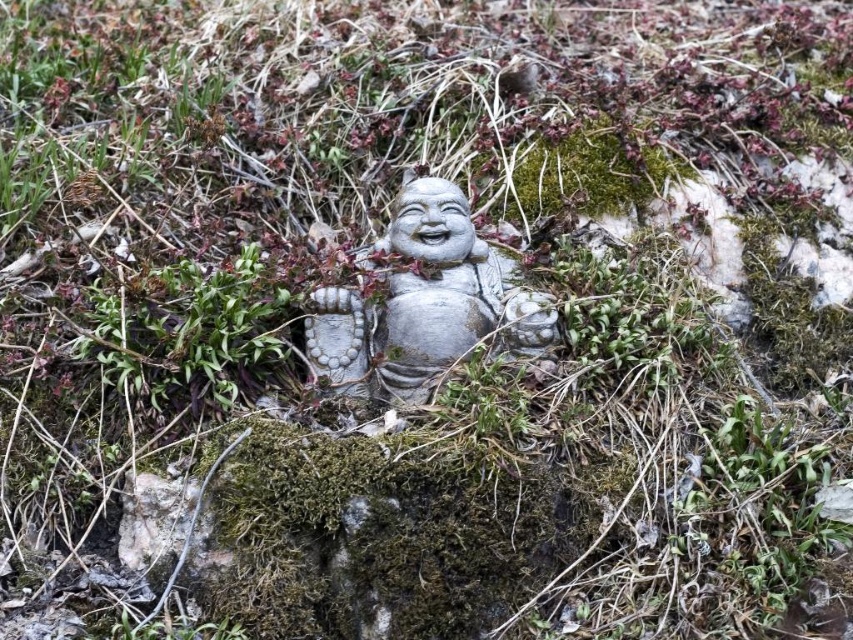
You are a gardener who wants to place a new decorative stone in front of the satin silver statue at center so that it is visible from where you are standing. Where should you place the new stone relative to the green moss at center?

The satin silver statue at center is further to the viewer than green moss at center, so you should place the new stone in front of the green moss at center to ensure it is visible from your current position.

You are a landscape designer planning to place a new decorative fountain in the garden. The garden currently has a point marked at coordinates point (425, 304). Where exactly is this point located in relation to the satin silver statue at center?

The point (425, 304) marks the satin silver statue at center, so the coordinates directly indicate the position of the satin silver statue at center.

You are a gardener who wants to place a new plant between the satin silver statue at center and the green moss at center. Since the statue is above the moss, where should you place the plant to ensure it is between them?

Since the satin silver statue at center is located above the green moss at center, you should place the new plant between them by positioning it below the statue but above the moss.